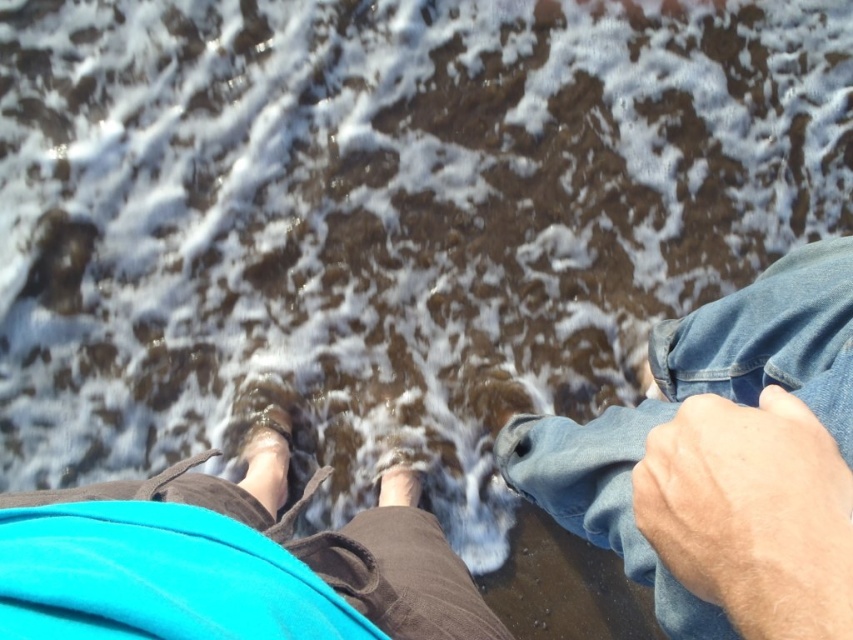
Question: Is the position of denim at lower right more distant than that of brown suede sandal at lower center?

Choices:
 (A) no
 (B) yes

Answer: (A)

Question: Which point is farther to the camera?

Choices:
 (A) (389, 502)
 (B) (252, 492)

Answer: (A)

Question: Which object is farther from the camera taking this photo?

Choices:
 (A) smooth skin foot at center
 (B) brown suede sandal at lower center

Answer: (A)

Question: Can you confirm if brown suede sandal at lower center is positioned to the left of smooth skin foot at center?

Choices:
 (A) yes
 (B) no

Answer: (A)

Question: Is brown suede sandal at lower center closer to camera compared to smooth skin foot at center?

Choices:
 (A) yes
 (B) no

Answer: (A)

Question: Which object is the closest to the smooth skin foot at center?

Choices:
 (A) denim at lower right
 (B) brown suede sandal at lower center

Answer: (B)